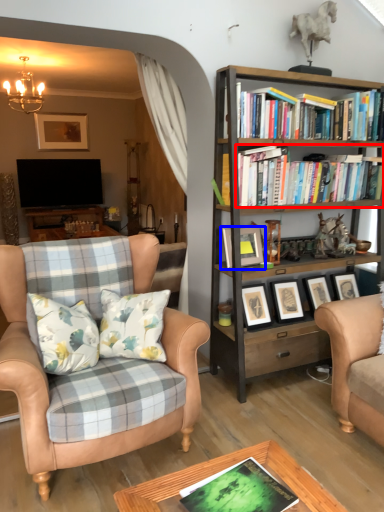
Question: Which of the following is the closest to the observer, book (highlighted by a red box) or picture frame (highlighted by a blue box)?

Choices:
 (A) book
 (B) picture frame

Answer: (B)